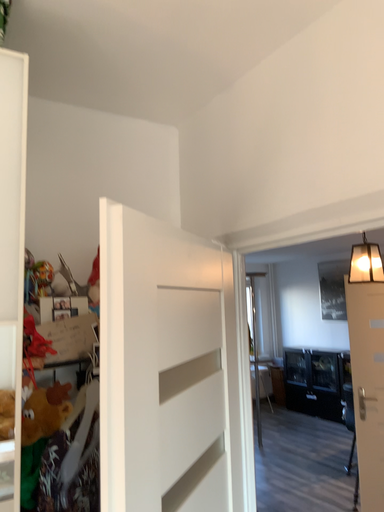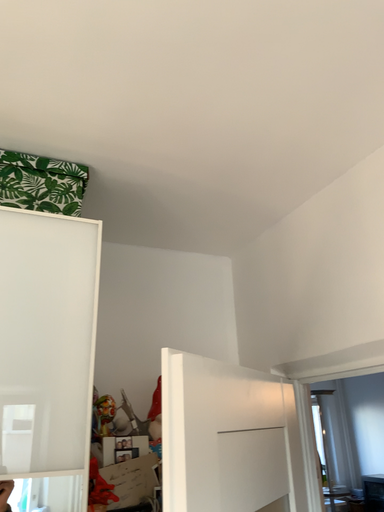
Question: Which way did the camera rotate in the video?

Choices:
 (A) rotated left
 (B) rotated right

Answer: (A)